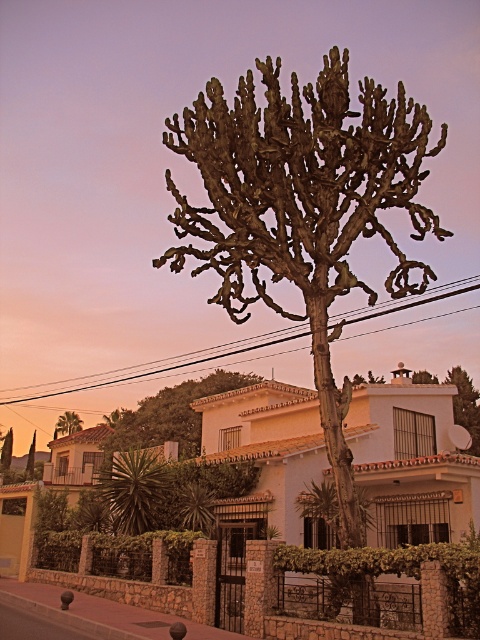
Question: Estimate the real-world distances between objects in this image. Which object is farther from the brown textured cactus at center?

Choices:
 (A) green leafy tree at upper left
 (B) green spiky plant at lower left

Answer: (B)

Question: Which of these objects is positioned farthest from the green spiky plant at lower left?

Choices:
 (A) green leafy tree at upper left
 (B) brown textured cactus at center

Answer: (A)

Question: Is green spiky cactus at center thinner than green leafy tree at upper left?

Choices:
 (A) no
 (B) yes

Answer: (A)

Question: Does green spiky cactus at center appear on the right side of green spiky plant at lower left?

Choices:
 (A) no
 (B) yes

Answer: (B)

Question: Which of the following is the farthest from the observer?

Choices:
 (A) (155, 516)
 (B) (199, 440)
 (C) (59, 433)

Answer: (C)

Question: Does green spiky cactus at center have a larger size compared to green spiky plant at lower left?

Choices:
 (A) no
 (B) yes

Answer: (B)